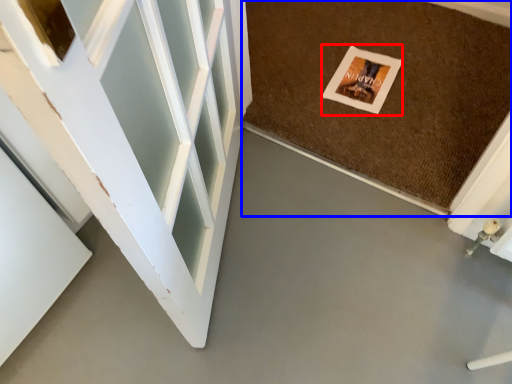
Question: Which of the following is the closest to the observer, postcard (highlighted by a red box) or mat (highlighted by a blue box)?

Choices:
 (A) postcard
 (B) mat

Answer: (B)